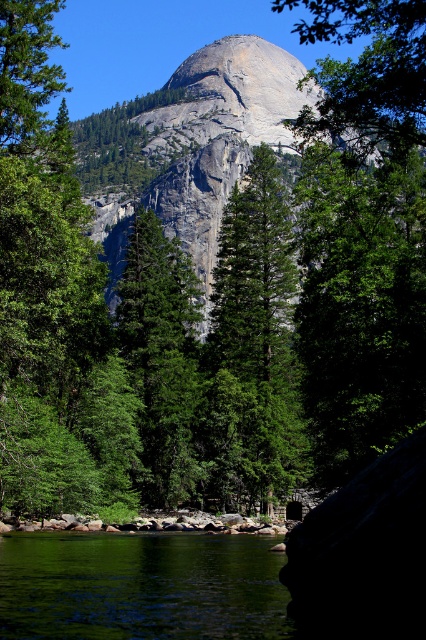
Question: Can you confirm if green smooth water at lower left is positioned to the left of green textured tree at center?

Choices:
 (A) yes
 (B) no

Answer: (A)

Question: Is the position of green smooth water at lower left less distant than that of gray granite mountain at center?

Choices:
 (A) no
 (B) yes

Answer: (B)

Question: Which object is closer to the camera taking this photo?

Choices:
 (A) gray granite mountain at center
 (B) green textured tree at center
 (C) green smooth water at lower left
 (D) green matte tree at center

Answer: (C)

Question: Among these objects, which one is farthest from the camera?

Choices:
 (A) green smooth water at lower left
 (B) green textured tree at center
 (C) gray granite mountain at center
 (D) green matte tree at center

Answer: (C)

Question: Is gray granite mountain at center closer to camera compared to green matte tree at center?

Choices:
 (A) no
 (B) yes

Answer: (A)

Question: Which point appears farthest from the camera in this image?

Choices:
 (A) (249, 314)
 (B) (40, 540)
 (C) (166, 106)

Answer: (C)